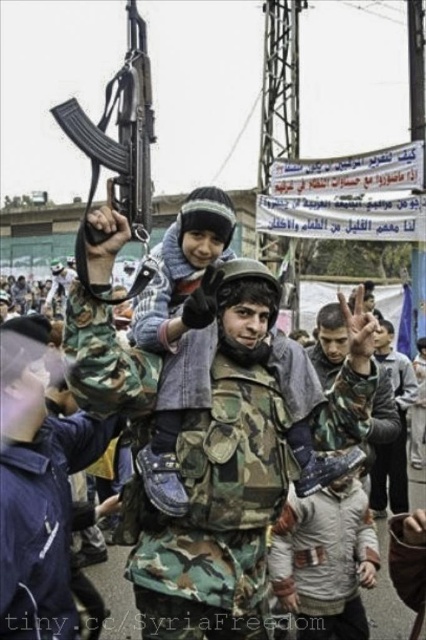
Question: Which object is closer to the camera taking this photo?

Choices:
 (A) matte black rifle at upper left
 (B) camouflage jacket at center
 (C) camouflage-patterned jacket at center

Answer: (C)

Question: Considering the real-world distances, which object is farthest from the camouflage fabric uniform at lower left?

Choices:
 (A) camouflage uniform at center
 (B) camouflage jacket at center

Answer: (A)

Question: Does camouflage fabric uniform at lower left have a greater width compared to camouflage uniform at center?

Choices:
 (A) no
 (B) yes

Answer: (B)

Question: Among these objects, which one is farthest from the camera?

Choices:
 (A) camouflage fabric uniform at lower left
 (B) camouflage jacket at center
 (C) matte black rifle at upper left
 (D) camouflage-patterned jacket at center

Answer: (B)

Question: Can you confirm if camouflage-patterned jacket at center is thinner than camouflage jacket at center?

Choices:
 (A) yes
 (B) no

Answer: (A)

Question: Can you confirm if camouflage fabric uniform at lower left is positioned to the right of matte black rifle at upper left?

Choices:
 (A) yes
 (B) no

Answer: (A)